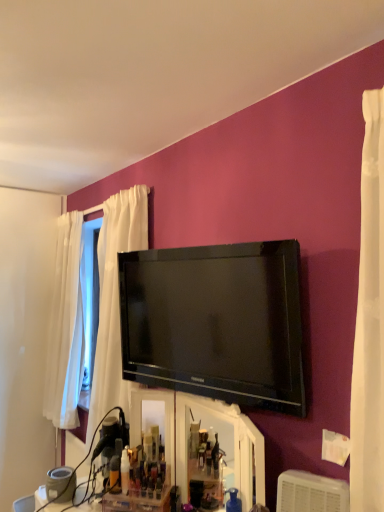
This screenshot has height=512, width=384. Find the location of `free point above white plastic air conditioner at lower right (from a real-world perspective)`. free point above white plastic air conditioner at lower right (from a real-world perspective) is located at coordinates (316, 481).